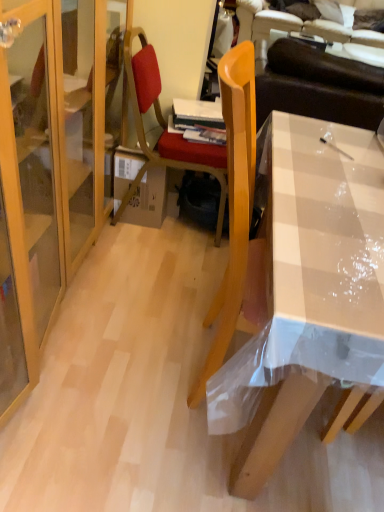
Question: Is wooden chair at center a part of brown leather couch at upper right?

Choices:
 (A) yes
 (B) no

Answer: (B)

Question: Can you confirm if brown leather couch at upper right is thinner than wooden chair at center?

Choices:
 (A) no
 (B) yes

Answer: (A)

Question: Is brown leather couch at upper right positioned beyond the bounds of wooden chair at center?

Choices:
 (A) no
 (B) yes

Answer: (B)

Question: Considering the relative sizes of brown leather couch at upper right and wooden chair at center in the image provided, is brown leather couch at upper right taller than wooden chair at center?

Choices:
 (A) yes
 (B) no

Answer: (A)

Question: Is the position of brown leather couch at upper right less distant than that of wooden chair at center?

Choices:
 (A) no
 (B) yes

Answer: (A)

Question: Considering the relative sizes of brown leather couch at upper right and wooden chair at center in the image provided, is brown leather couch at upper right smaller than wooden chair at center?

Choices:
 (A) no
 (B) yes

Answer: (A)

Question: Is the depth of wooden chair at center less than that of brown leather couch at upper right?

Choices:
 (A) no
 (B) yes

Answer: (B)

Question: Does wooden chair at center have a greater height compared to brown leather couch at upper right?

Choices:
 (A) no
 (B) yes

Answer: (A)

Question: Is wooden chair at center smaller than brown leather couch at upper right?

Choices:
 (A) no
 (B) yes

Answer: (B)

Question: Are wooden chair at center and brown leather couch at upper right located far from each other?

Choices:
 (A) yes
 (B) no

Answer: (B)

Question: Is brown leather couch at upper right surrounded by wooden chair at center?

Choices:
 (A) yes
 (B) no

Answer: (B)

Question: From a real-world perspective, is wooden chair at center over brown leather couch at upper right?

Choices:
 (A) yes
 (B) no

Answer: (B)

Question: Considering the relative sizes of cardboard box at center and clear plastic desk at center in the image provided, is cardboard box at center shorter than clear plastic desk at center?

Choices:
 (A) no
 (B) yes

Answer: (B)